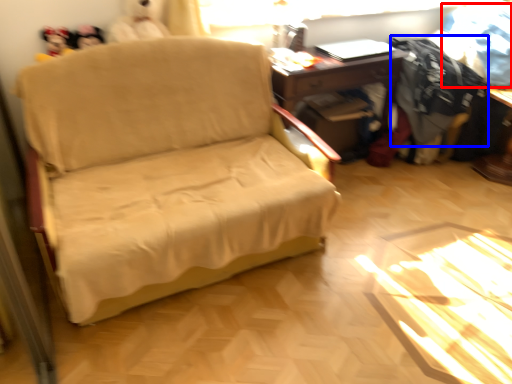
Question: Which of the following is the closest to the observer, clothing (highlighted by a red box) or clothing (highlighted by a blue box)?

Choices:
 (A) clothing
 (B) clothing

Answer: (A)